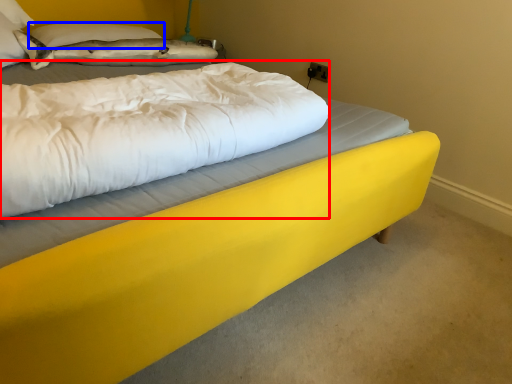
Question: Which point is closer to the camera, mattress (highlighted by a red box) or pillow (highlighted by a blue box)?

Choices:
 (A) mattress
 (B) pillow

Answer: (A)